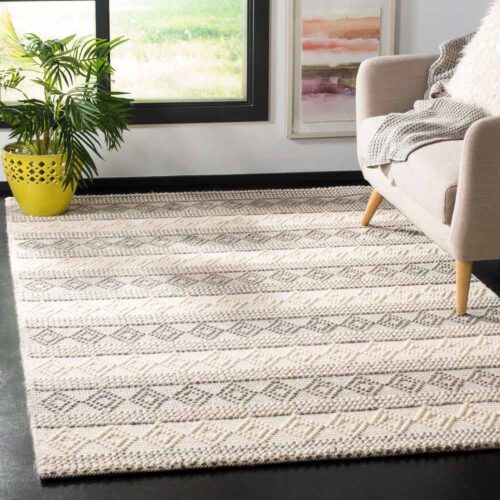
Find the location of a particular element. The width and height of the screenshot is (500, 500). space right of painting is located at coordinates (426, 17).